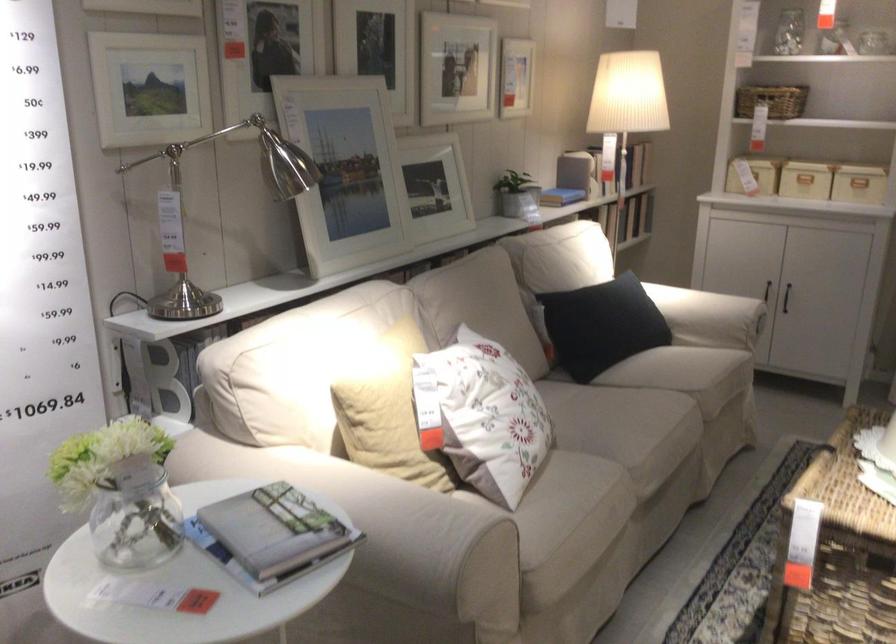
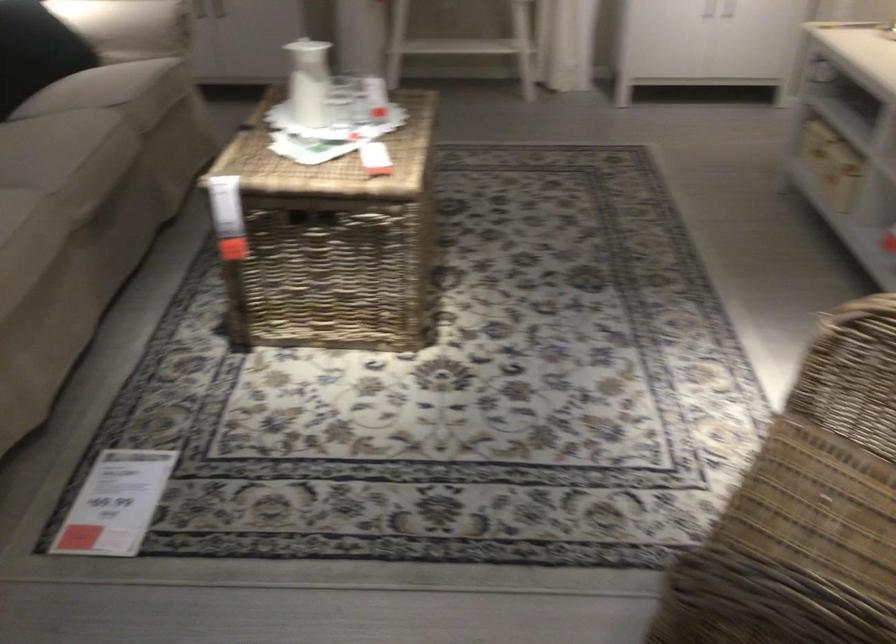
Locate, in the second image, the point that corresponds to (684,422) in the first image.

(109, 140)